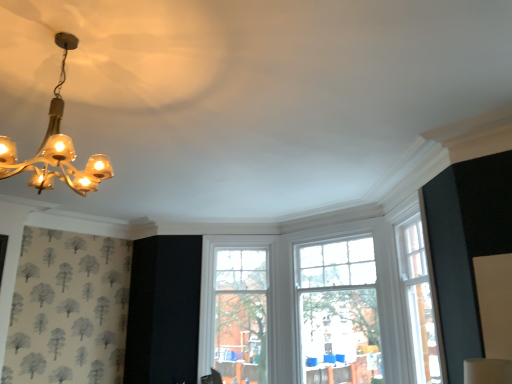
Identify the location of clear glass window at center, the 1th window viewed from the right. coord(338,311).

Is clear glass window at center, which ranks as the 1th window in left-to-right order, not close to clear glass window at center, the second window positioned from the left?

Actually, clear glass window at center, which ranks as the 1th window in left-to-right order, and clear glass window at center, the second window positioned from the left, are a little close together.

Considering the relative positions of clear glass window at center, the second window positioned from the right, and clear glass window at center, the 1th window viewed from the right, in the image provided, is clear glass window at center, the second window positioned from the right, in front of clear glass window at center, the 1th window viewed from the right,?

No, clear glass window at center, the second window positioned from the right, is further to the viewer.

From the picture: Can you tell me how much clear glass window at center, the second window positioned from the right, and clear glass window at center, the 1th window viewed from the right, differ in facing direction?

There is a 41.7-degree angle between the facing directions of clear glass window at center, the second window positioned from the right, and clear glass window at center, the 1th window viewed from the right.

How far apart are gold glass chandelier at upper left and clear glass window at center, the 1th window viewed from the right?

The distance of gold glass chandelier at upper left from clear glass window at center, the 1th window viewed from the right, is 3.88 meters.

Is gold glass chandelier at upper left touching clear glass window at center, the second window positioned from the left?

gold glass chandelier at upper left and clear glass window at center, the second window positioned from the left, are clearly separated.

Could you tell me if gold glass chandelier at upper left is facing clear glass window at center, the second window positioned from the left?

No, gold glass chandelier at upper left is not aimed at clear glass window at center, the second window positioned from the left.

Which is more to the left, gold glass chandelier at upper left or clear glass window at center, the second window positioned from the left?

Positioned to the left is gold glass chandelier at upper left.

Which object is more forward, gold glass chandelier at upper left or clear glass window at center, which ranks as the 1th window in left-to-right order?

gold glass chandelier at upper left is in front.

From a real-world perspective, which is physically below, gold glass chandelier at upper left or clear glass window at center, the second window positioned from the right?

In real-world perspective, clear glass window at center, the second window positioned from the right, is lower.

Could you tell me if gold glass chandelier at upper left is turned towards clear glass window at center, the second window positioned from the right?

No.

Considering the relative sizes of gold glass chandelier at upper left and clear glass window at center, which ranks as the 1th window in left-to-right order, in the image provided, is gold glass chandelier at upper left wider than clear glass window at center, which ranks as the 1th window in left-to-right order,?

Yes, gold glass chandelier at upper left is wider than clear glass window at center, which ranks as the 1th window in left-to-right order.

From the image's perspective, is clear glass window at center, the second window positioned from the left, positioned above or below clear glass window at center, the second window positioned from the right?

clear glass window at center, the second window positioned from the left, is above clear glass window at center, the second window positioned from the right.

Is clear glass window at center, the 1th window viewed from the right, thinner than clear glass window at center, the second window positioned from the right?

Correct, the width of clear glass window at center, the 1th window viewed from the right, is less than that of clear glass window at center, the second window positioned from the right.

Which of these two, clear glass window at center, the second window positioned from the left, or clear glass window at center, the second window positioned from the right, is smaller?

Answer: clear glass window at center, the second window positioned from the right, is smaller.

Looking at this image, is clear glass window at center, the 1th window viewed from the right, positioned far away from clear glass window at center, which ranks as the 1th window in left-to-right order?

Actually, clear glass window at center, the 1th window viewed from the right, and clear glass window at center, which ranks as the 1th window in left-to-right order, are a little close together.

Considering the relative sizes of clear glass window at center, which ranks as the 1th window in left-to-right order, and gold glass chandelier at upper left in the image provided, is clear glass window at center, which ranks as the 1th window in left-to-right order, smaller than gold glass chandelier at upper left?

No, clear glass window at center, which ranks as the 1th window in left-to-right order, is not smaller than gold glass chandelier at upper left.

Considering the points (265, 282) and (97, 165), which point is in front, point (265, 282) or point (97, 165)?

The point (97, 165) is closer.

Looking at this image, is clear glass window at center, the second window positioned from the right, facing towards gold glass chandelier at upper left?

Yes, clear glass window at center, the second window positioned from the right, is turned towards gold glass chandelier at upper left.

From the image's perspective, is clear glass window at center, which ranks as the 1th window in left-to-right order, located beneath gold glass chandelier at upper left?

Indeed, from the image's perspective, clear glass window at center, which ranks as the 1th window in left-to-right order, is shown beneath gold glass chandelier at upper left.

Considering the relative positions of clear glass window at center, the second window positioned from the left, and gold glass chandelier at upper left in the image provided, is clear glass window at center, the second window positioned from the left, to the left of gold glass chandelier at upper left from the viewer's perspective?

Incorrect, clear glass window at center, the second window positioned from the left, is not on the left side of gold glass chandelier at upper left.

How much distance is there between clear glass window at center, the 1th window viewed from the right, and gold glass chandelier at upper left?

clear glass window at center, the 1th window viewed from the right, and gold glass chandelier at upper left are 3.88 meters apart from each other.

You are a GUI agent. You are given a task and a screenshot of the screen. Output one action in this format:
    pyautogui.click(x=<x>, y=<y>)
    Task: Click on the 1st window below the gold glass chandelier at upper left (from a real-world perspective)
    
    Given the screenshot: What is the action you would take?
    pyautogui.click(x=338, y=311)

Does clear glass window at center, the 1th window viewed from the right, have a greater width compared to gold glass chandelier at upper left?

Incorrect, the width of clear glass window at center, the 1th window viewed from the right, does not surpass that of gold glass chandelier at upper left.

The width and height of the screenshot is (512, 384). I want to click on window that appears on the right of clear glass window at center, the second window positioned from the right, so click(338, 311).

Which window is the 1st one when counting from the back of the gold glass chandelier at upper left? Please provide its 2D coordinates.

[(338, 311)]

Looking at the image, which one is located closer to clear glass window at center, the second window positioned from the right, gold glass chandelier at upper left or clear glass window at center, the 1th window viewed from the right?

The object closer to clear glass window at center, the second window positioned from the right, is clear glass window at center, the 1th window viewed from the right.

From the image, which object appears to be nearer to gold glass chandelier at upper left, clear glass window at center, the 1th window viewed from the right, or clear glass window at center, which ranks as the 1th window in left-to-right order?

Based on the image, clear glass window at center, the 1th window viewed from the right, appears to be nearer to gold glass chandelier at upper left.

Estimate the real-world distances between objects in this image. Which object is closer to gold glass chandelier at upper left, clear glass window at center, which ranks as the 1th window in left-to-right order, or clear glass window at center, the 1th window viewed from the right?

Based on the image, clear glass window at center, the 1th window viewed from the right, appears to be nearer to gold glass chandelier at upper left.

From the picture: When comparing their distances from clear glass window at center, the 1th window viewed from the right, does clear glass window at center, which ranks as the 1th window in left-to-right order, or gold glass chandelier at upper left seem further?

The object further to clear glass window at center, the 1th window viewed from the right, is gold glass chandelier at upper left.

Based on their spatial positions, is clear glass window at center, the second window positioned from the left, or gold glass chandelier at upper left closer to clear glass window at center, which ranks as the 1th window in left-to-right order?

clear glass window at center, the second window positioned from the left.

Looking at the image, which one is located further to clear glass window at center, the second window positioned from the left, gold glass chandelier at upper left or clear glass window at center, which ranks as the 1th window in left-to-right order?

gold glass chandelier at upper left is further to clear glass window at center, the second window positioned from the left.

The image size is (512, 384). What are the coordinates of `window between gold glass chandelier at upper left and clear glass window at center, the second window positioned from the right, from front to back` in the screenshot? It's located at (338, 311).